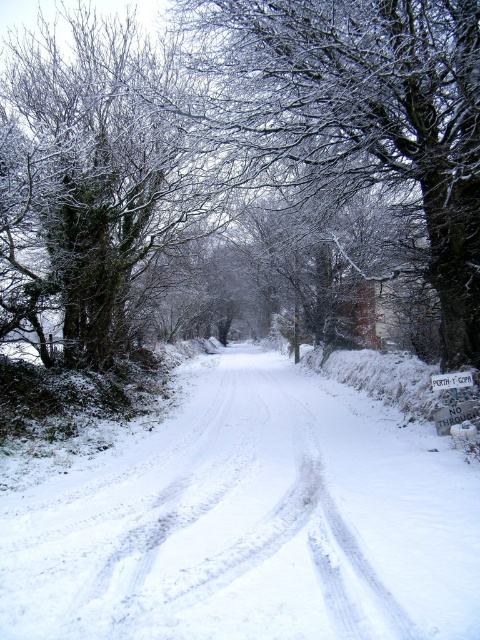
Which is above, white frosty tree at center or white plastic sign at center?

Positioned higher is white frosty tree at center.

Does white frosty tree at center have a smaller size compared to white plastic sign at center?

Yes, white frosty tree at center is smaller than white plastic sign at center.

Describe the element at coordinates (360, 113) in the screenshot. This screenshot has width=480, height=640. I see `white frosty tree at center` at that location.

At what (x,y) coordinates should I click in order to perform the action: click on white frosty tree at center. Please return your answer as a coordinate pair (x, y). Looking at the image, I should click on (360, 113).

Is white powdery snow at center below white plastic sign at center?

Correct, white powdery snow at center is located below white plastic sign at center.

Can you confirm if white powdery snow at center is smaller than white plastic sign at center?

No, white powdery snow at center is not smaller than white plastic sign at center.

This screenshot has width=480, height=640. I want to click on white powdery snow at center, so click(x=250, y=522).

Locate an element on the screen. white powdery snow at center is located at coordinates (250, 522).

Is white powdery snow at center shorter than white frosty tree at center?

No.

Can you confirm if white powdery snow at center is positioned below white frosty tree at center?

Yes.

Is point (383, 618) farther from viewer compared to point (425, 129)?

No, (383, 618) is in front of (425, 129).

What are the coordinates of `white powdery snow at center` in the screenshot? It's located at click(x=250, y=522).